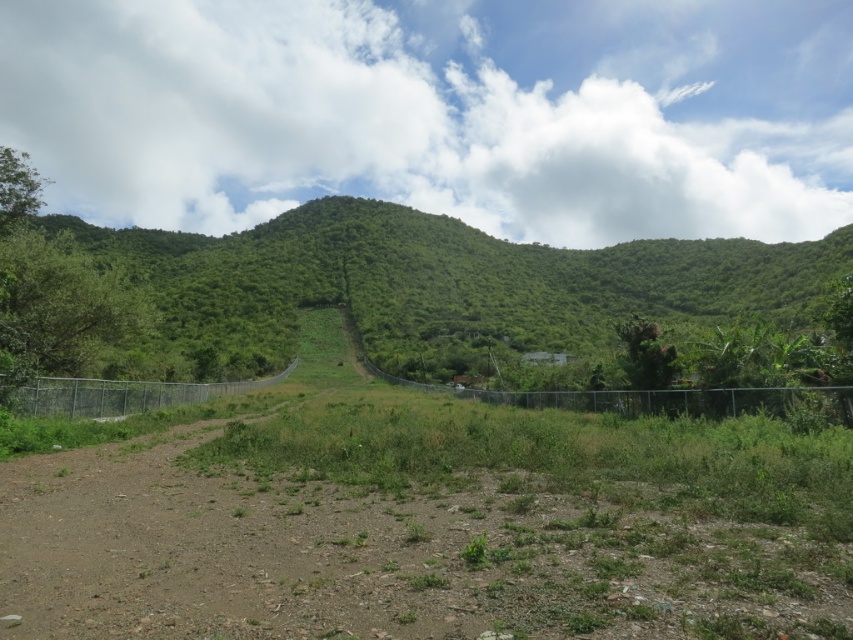
You are standing at the center of the image and want to reach the green leafy mountain at center. Given its coordinates, is it directly in front of you or to one side?

The green leafy mountain at center is located at coordinates point (432,288), which means it is directly in front of you since it is at the center of the image.